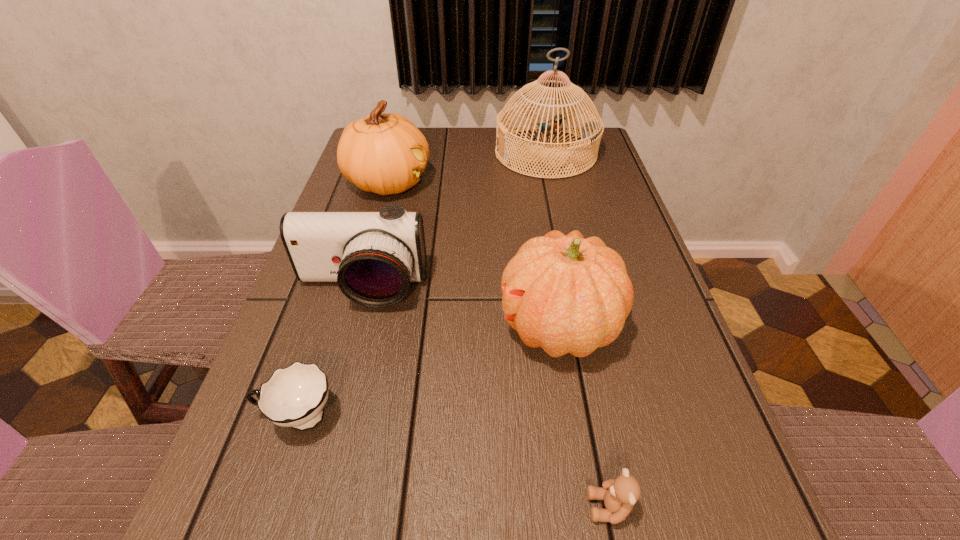
Locate an element on the screen. blank area located 0.070m on the front face of the left pumpkin is located at coordinates (457, 183).

Locate an element on the screen. The width and height of the screenshot is (960, 540). free location located on the surface of the fourth tallest object is located at coordinates (316, 458).

The image size is (960, 540). I want to click on free region located 0.140m on the face of the teddy bear, so click(488, 507).

The height and width of the screenshot is (540, 960). I want to click on vacant position located 0.300m on the face of the teddy bear, so click(x=373, y=507).

The height and width of the screenshot is (540, 960). Identify the location of vacant area situated on the face of the teddy bear. (467, 507).

Where is `birdcage positioned at the far edge`? This screenshot has width=960, height=540. birdcage positioned at the far edge is located at coordinates (591, 132).

The width and height of the screenshot is (960, 540). What are the coordinates of `pumpkin at the far edge` in the screenshot? It's located at [385, 153].

You are a GUI agent. You are given a task and a screenshot of the screen. Output one action in this format:
    pyautogui.click(x=<x>, y=<y>)
    Task: Click on the pumpkin at the left edge
    The image size is (960, 540).
    Given the screenshot: What is the action you would take?
    pyautogui.click(x=385, y=153)

Find the location of a particular element. Image resolution: width=960 pixels, height=540 pixels. camcorder that is at the left edge is located at coordinates (373, 256).

This screenshot has height=540, width=960. Find the location of `cup located at the left edge`. cup located at the left edge is located at coordinates (294, 396).